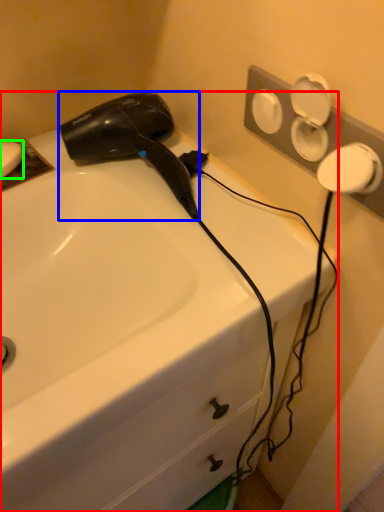
Question: Which object is the closest to the sink (highlighted by a red box)? Choose among these: hair drier (highlighted by a blue box) or soap (highlighted by a green box).

Choices:
 (A) hair drier
 (B) soap

Answer: (A)